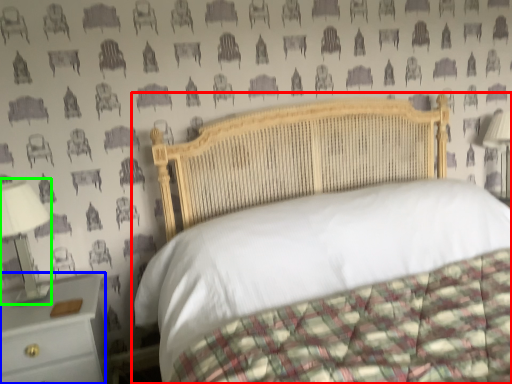
Question: Estimate the real-world distances between objects in this image. Which object is farther from bed (highlighted by a red box), nightstand (highlighted by a blue box) or bedside lamp (highlighted by a green box)?

Choices:
 (A) nightstand
 (B) bedside lamp

Answer: (B)